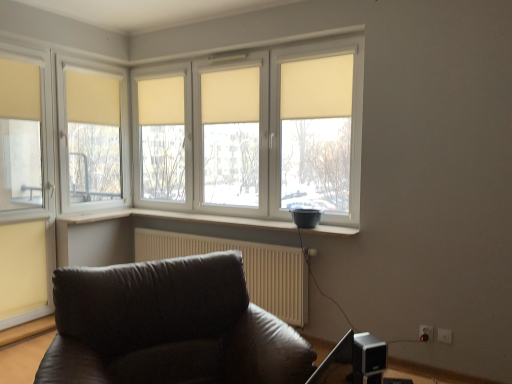
Question: Considering the positions of beige fabric curtain at center, which is the third curtain in left-to-right order, and white plastic electric outlet at lower right, placed as the 1th electric outlet when sorted from right to left, in the image, is beige fabric curtain at center, which is the third curtain in left-to-right order, wider or thinner than white plastic electric outlet at lower right, placed as the 1th electric outlet when sorted from right to left,?

Choices:
 (A) thin
 (B) wide

Answer: (B)

Question: Which is correct: beige fabric curtain at center, which is the third curtain in left-to-right order, is inside white plastic electric outlet at lower right, placed as the 1th electric outlet when sorted from right to left, or outside of it?

Choices:
 (A) inside
 (B) outside

Answer: (B)

Question: Estimate the real-world distances between objects in this image. Which object is farther from the white textured radiator at lower center?

Choices:
 (A) white plastic electric outlet at lower right, which ranks as the 1th electric outlet in left-to-right order
 (B) white plastic window sill at center
 (C) beige fabric curtain at upper right, which appears as the 1th curtain when viewed from the right
 (D) beige fabric curtain at center, which is the third curtain in left-to-right order
 (E) matte yellow curtain at upper left, acting as the fifth curtain starting from the right

Answer: (E)

Question: Which of these objects is positioned farthest from the beige fabric curtain at upper left, which is the 4th curtain from right to left?

Choices:
 (A) white plastic electric outlet at lower right, the second electric outlet when ordered from right to left
 (B) beige fabric curtain at upper right, which ranks as the 5th curtain in left-to-right order
 (C) beige fabric curtain at center, which is counted as the second curtain, starting from the right
 (D) beige fabric curtain at center, the 3th curtain when ordered from right to left
 (E) matte yellow curtain at upper left, which appears as the 1th curtain when viewed from the left

Answer: (A)